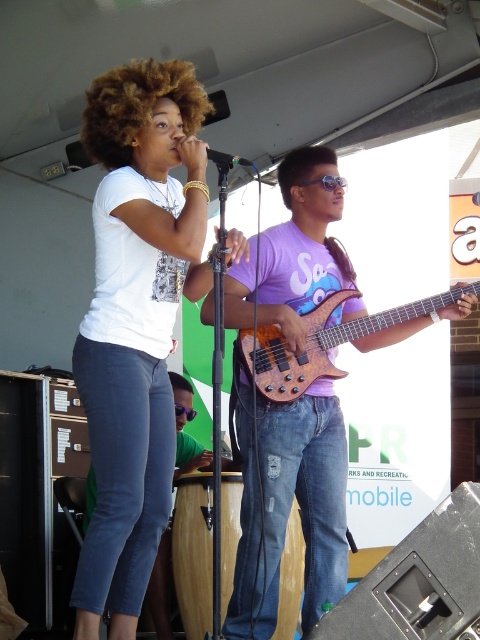
From the picture: You are a photographer trying to capture the bass guitarist in the image. The bass guitarist is wearing a purple t shirt with a graphic design. You want to ensure that your camera is focused on the exact center of his purple shirt. The coordinates provided in the image are in a normalized format where the top left corner is 0,0 and the bottom right is 1,1. The point at (303, 496) is on the purple shirt at center. What are the coordinates of the center of his purple shirt?

The coordinates of the center of his purple shirt at center are (303, 496).

You are a photographer positioned at the front of the stage. You want to capture a photo that includes both the singer and the bassist. The singer is at point (171, 144) and the bassist is at point (284, 531). Based on their positions, which performer will appear closer to the camera in the photo?

Point (171, 144) is further to the viewer than point (284, 531), so the singer at point (171, 144) will appear closer to the camera in the photo.

Consider the image. You are a photographer at the back of the stage. You want to take a photo of both the matte purple shirt at center and the metallic silver microphone at center. Which object should you zoom in more on to ensure both are clearly visible in the photo?

The matte purple shirt at center has a larger size compared to the metallic silver microphone at center, so you should zoom in more on the matte purple shirt at center to ensure both are clearly visible in the photo.